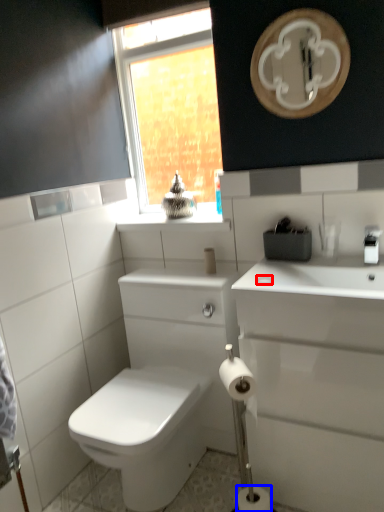
Question: Among these objects, which one is nearest to the camera, soap (highlighted by a red box) or toilet paper (highlighted by a blue box)?

Choices:
 (A) soap
 (B) toilet paper

Answer: (B)